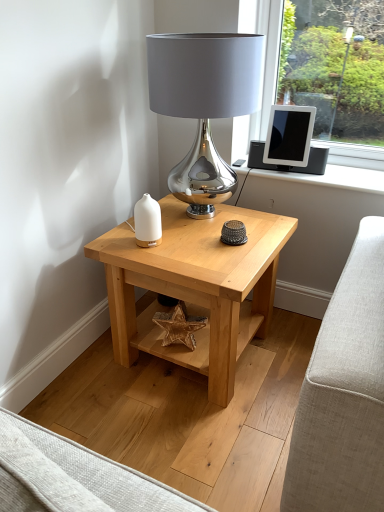
Where is `free space to the back side of white matte vase at center`? free space to the back side of white matte vase at center is located at coordinates (165, 226).